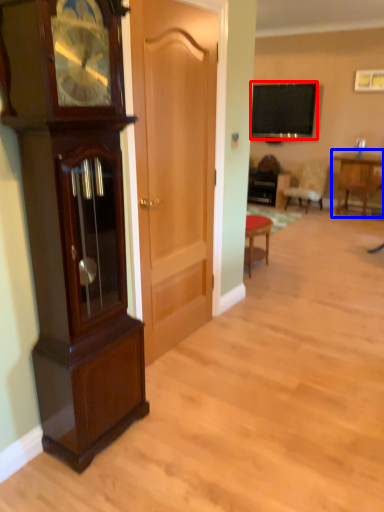
Question: Which object appears farthest to the camera in this image, television (highlighted by a red box) or table (highlighted by a blue box)?

Choices:
 (A) television
 (B) table

Answer: (A)